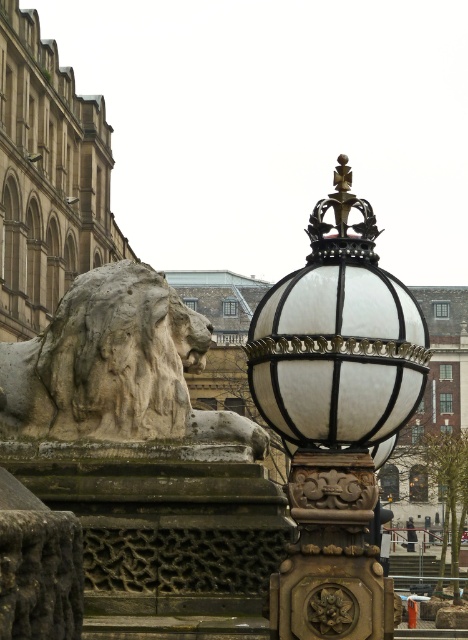
Does point (290, 630) lie behind point (82, 353)?

That is False.

Identify the location of white glass lamp post at center. (336, 417).